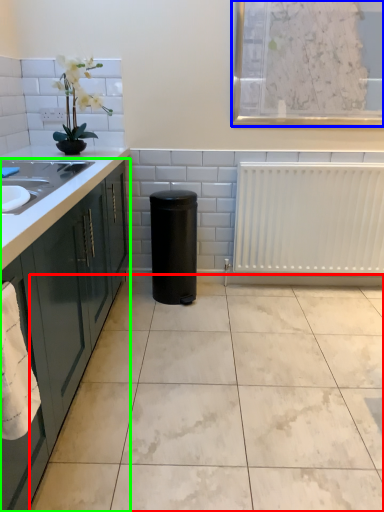
Question: Considering the real-world distances, which object is farthest from ceramic tile (highlighted by a red box)? window screen (highlighted by a blue box) or cabinetry (highlighted by a green box)?

Choices:
 (A) window screen
 (B) cabinetry

Answer: (A)